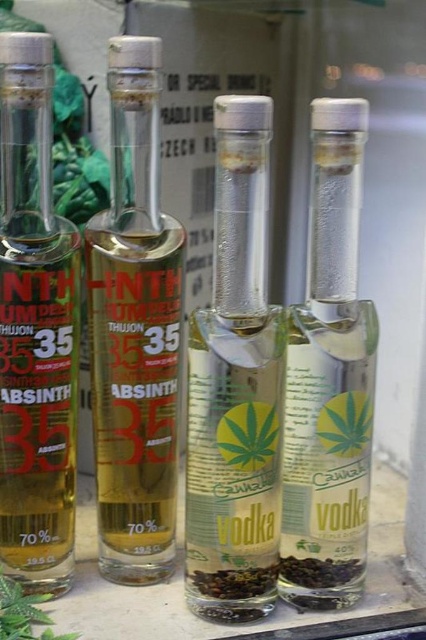
Question: Does clear glass absinth at center have a lesser width compared to green leafy parsley at lower left?

Choices:
 (A) no
 (B) yes

Answer: (A)

Question: Which point appears closest to the camera in this image?

Choices:
 (A) (40, 173)
 (B) (16, 593)

Answer: (A)

Question: Does clear glass absinth at center appear on the left side of translucent glass absinth at left?

Choices:
 (A) yes
 (B) no

Answer: (B)

Question: Which point appears farthest from the camera in this image?

Choices:
 (A) (172, 232)
 (B) (233, 337)

Answer: (A)

Question: Estimate the real-world distances between objects in this image. Which object is closer to the transparent glass vodka at right?

Choices:
 (A) transparent glass vodka at center
 (B) green leafy parsley at lower left
 (C) clear glass absinth at center
 (D) translucent glass absinth at left

Answer: (A)

Question: Is clear glass absinth at center positioned in front of green leafy parsley at lower left?

Choices:
 (A) no
 (B) yes

Answer: (A)